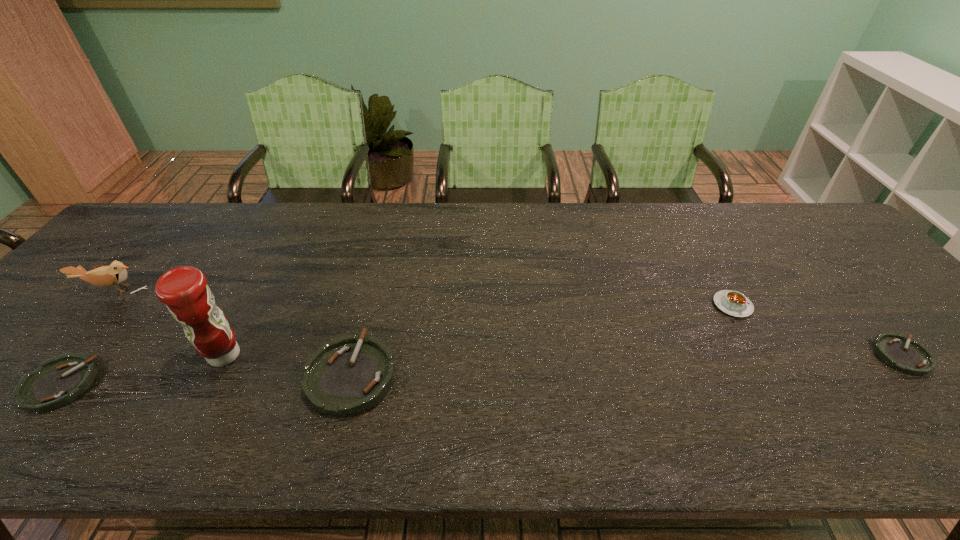
Please point a space for a new ashtray to maintain equal intervals. Please provide its 2D coordinates. Your answer should be formatted as a tuple, i.e. [(x, y)], where the tuple contains the x and y coordinates of a point satisfying the conditions above.

[(631, 365)]